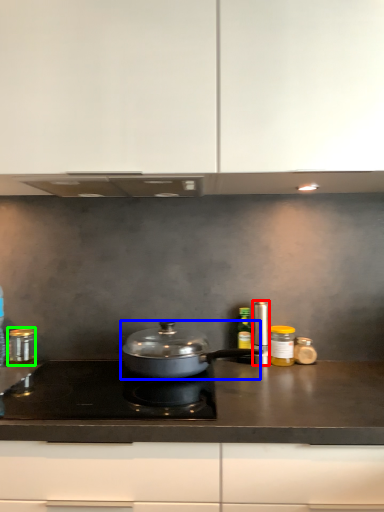
Question: Which object is the farthest from kitchen appliance (highlighted by a red box)? Choose among these: kitchen appliance (highlighted by a blue box) or kitchen appliance (highlighted by a green box).

Choices:
 (A) kitchen appliance
 (B) kitchen appliance

Answer: (B)